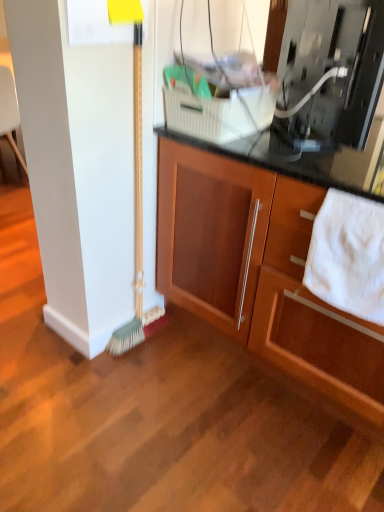
The width and height of the screenshot is (384, 512). Identify the location of space that is in front of green bristle broom at left. (132, 370).